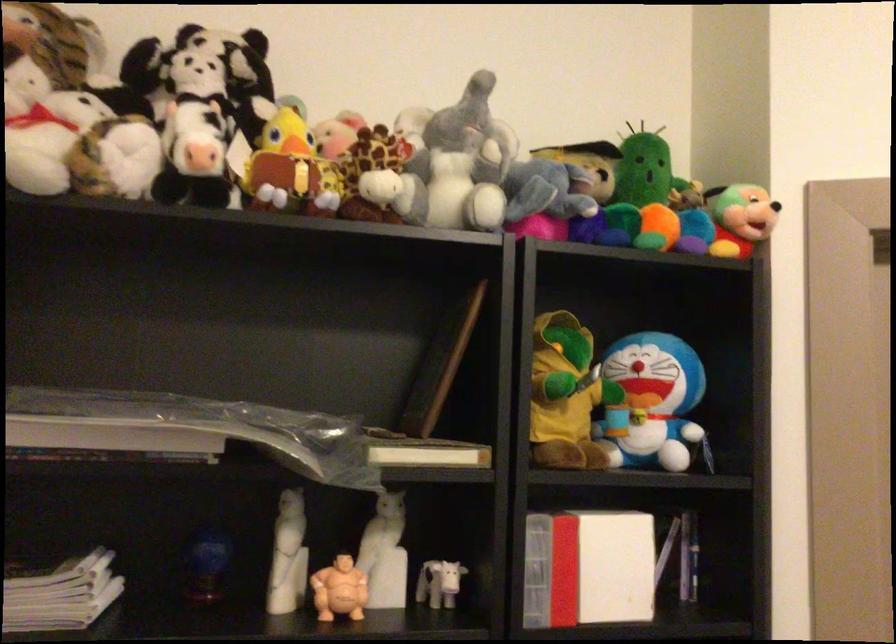
Find where to lift the blue doraemon toy. Please return your answer as a coordinate pair (x, y).

(651, 402)